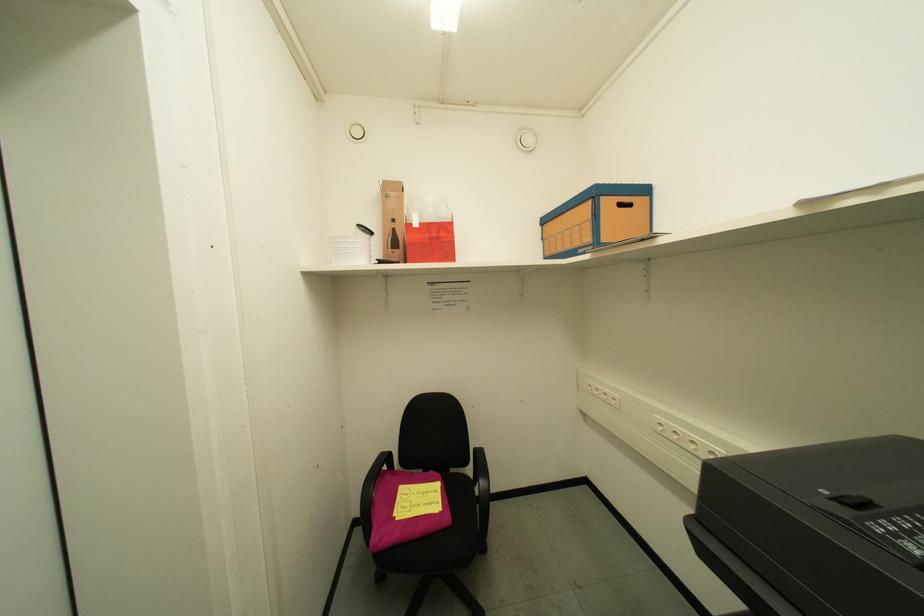
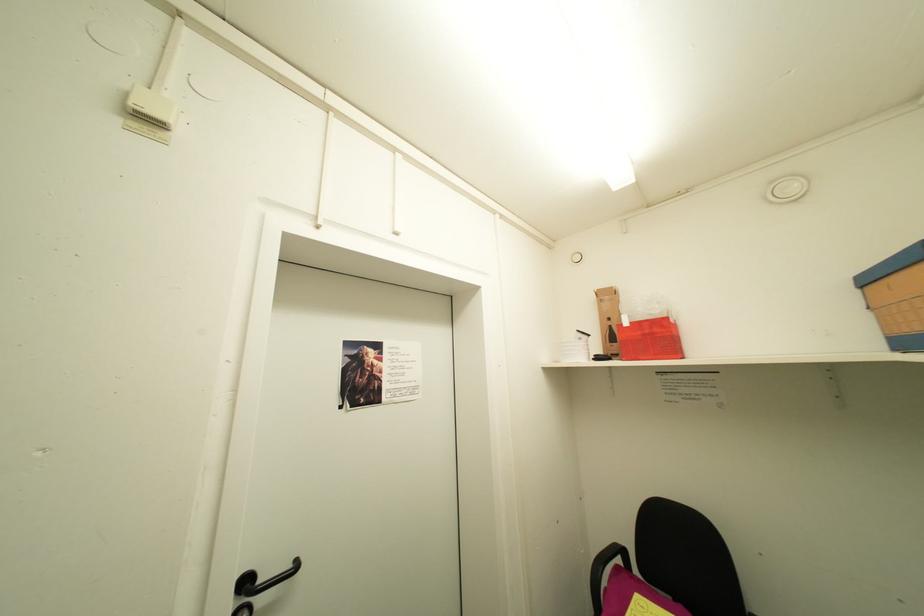
Question: Based on the continuous images, in which direction is the camera rotating? Reply with the corresponding letter.

Choices:
 (A) Left
 (B) Right
 (C) Up
 (D) Down

Answer: (A)